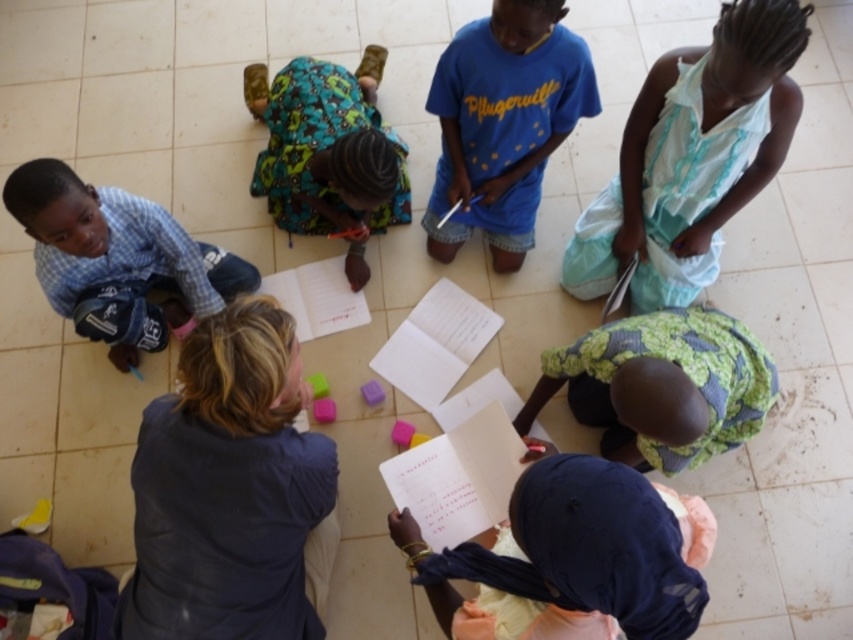
Question: Which point is farther to the camera?

Choices:
 (A) [544, 115]
 (B) [349, 256]
 (C) [605, 364]
 (D) [550, 532]

Answer: (B)

Question: Is checkered fabric shirt at left below printed fabric dress at center?

Choices:
 (A) yes
 (B) no

Answer: (A)

Question: Among these points, which one is farthest from the camera?

Choices:
 (A) (677, 438)
 (B) (714, 244)
 (C) (552, 566)

Answer: (B)

Question: Among these objects, which one is nearest to the camera?

Choices:
 (A) checkered fabric shirt at left
 (B) white lace dress at upper right

Answer: (B)

Question: Is white paper at center bigger than green textured cloth at lower right?

Choices:
 (A) yes
 (B) no

Answer: (B)

Question: From the image, what is the correct spatial relationship of white paper at center in relation to printed fabric dress at center?

Choices:
 (A) right
 (B) left

Answer: (A)